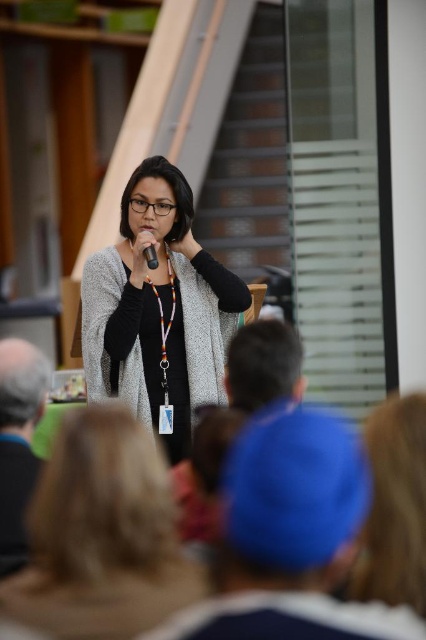
Question: Is gray fabric cap at lower left wider than black plastic microphone at center?

Choices:
 (A) no
 (B) yes

Answer: (B)

Question: Where is matte gray cardigan at center located in relation to black plastic microphone at center in the image?

Choices:
 (A) below
 (B) above

Answer: (A)

Question: Which of the following is the closest to the observer?

Choices:
 (A) [x=262, y=381]
 (B) [x=193, y=628]

Answer: (B)

Question: Considering the real-world distances, which object is closest to the matte gray cardigan at center?

Choices:
 (A) blue fabric cap at lower center
 (B) blonde hair at lower left

Answer: (A)

Question: Is blonde hair at lower left to the right of black plastic microphone at center from the viewer's perspective?

Choices:
 (A) yes
 (B) no

Answer: (B)

Question: Which of the following is the farthest from the observer?

Choices:
 (A) black plastic microphone at center
 (B) blonde hair at lower left
 (C) gray fabric cap at lower left

Answer: (A)